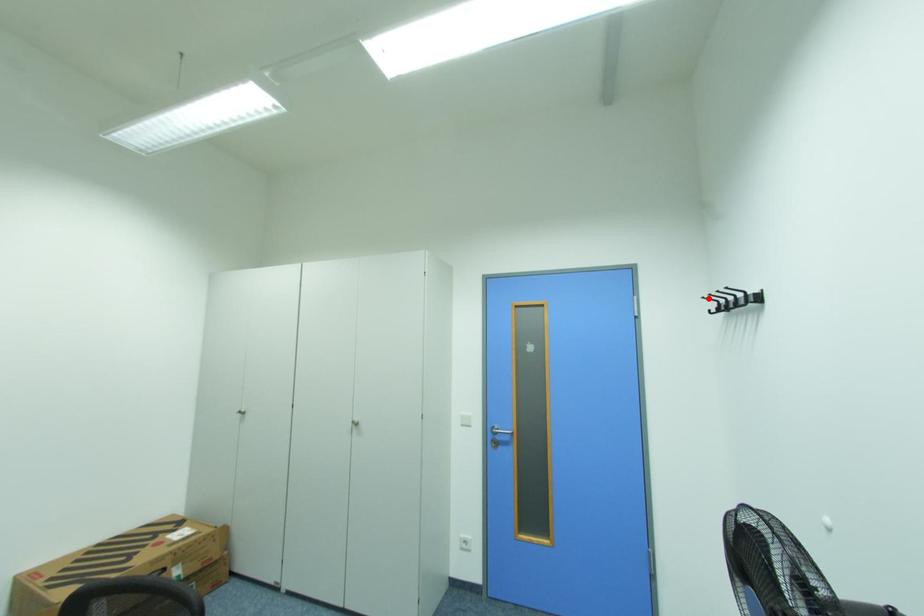
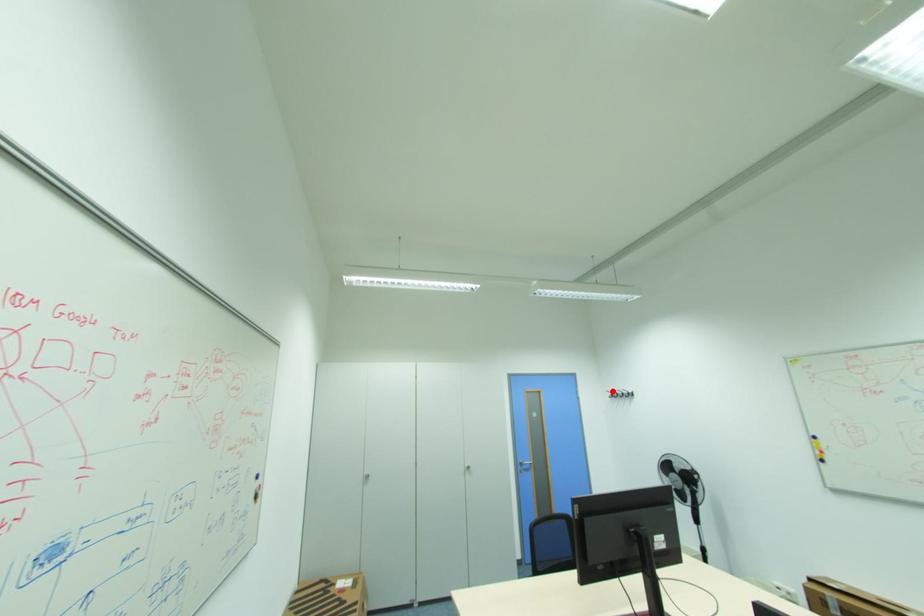
I am providing you with two images of the same scene from different viewpoints. A red point is marked on the first image and another point is marked on the second image. Is the red point in image1 aligned with the point shown in image2?

Yes